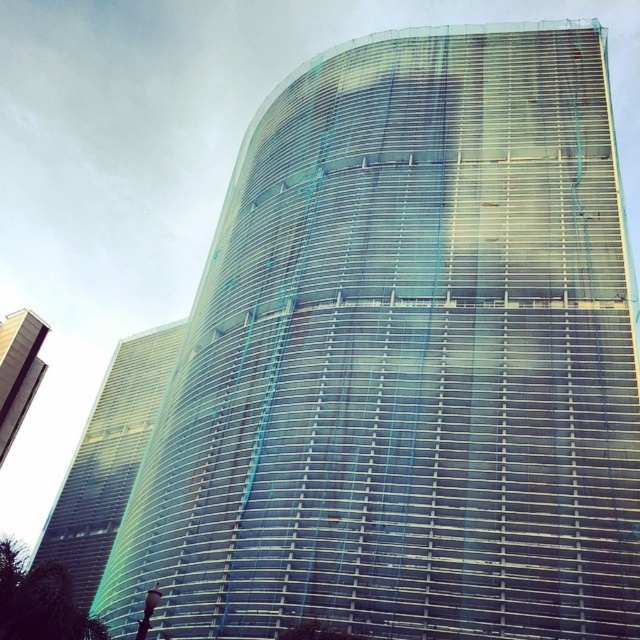
Question: Can you confirm if transparent glass building at center is thinner than clear glass building at upper left?

Choices:
 (A) no
 (B) yes

Answer: (A)

Question: Which point is farther to the camera?

Choices:
 (A) transparent glass building at center
 (B) clear glass building at upper left

Answer: (B)

Question: Is transparent glass building at center wider than clear glass building at upper left?

Choices:
 (A) yes
 (B) no

Answer: (A)

Question: Among these points, which one is farthest from the camera?

Choices:
 (A) (8, 339)
 (B) (93, 522)

Answer: (B)

Question: Can you confirm if transparent glass building at center is thinner than clear glass building at upper left?

Choices:
 (A) yes
 (B) no

Answer: (B)

Question: Which of the following is the farthest from the observer?

Choices:
 (A) (124, 381)
 (B) (38, 330)

Answer: (A)